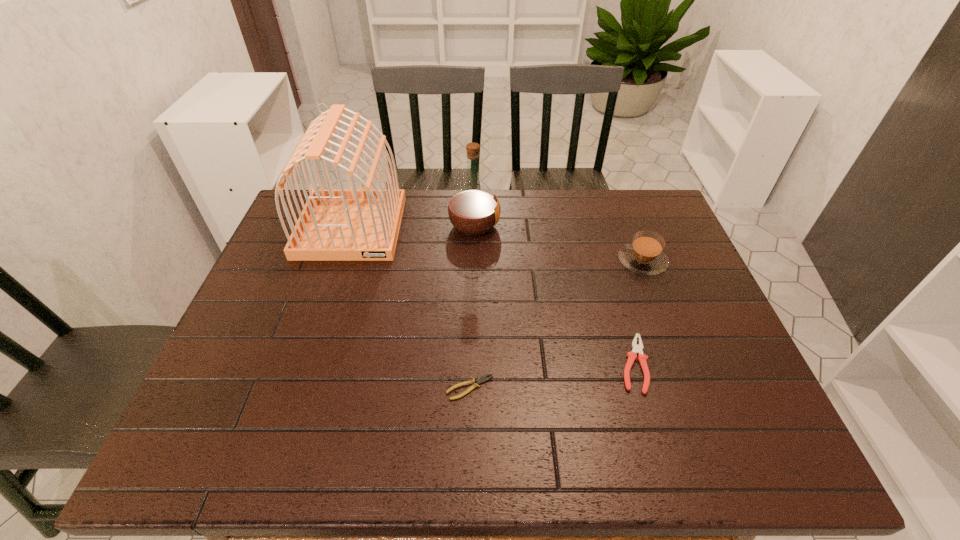
Locate an element on the screen. free location located on the front label of the fourth shortest object is located at coordinates (544, 226).

The image size is (960, 540). What are the coordinates of `blank space located on the back of the rightmost object` in the screenshot? It's located at (621, 206).

The height and width of the screenshot is (540, 960). I want to click on free space located on the back of the second shortest object, so click(607, 273).

What are the coordinates of `free space located on the left of the shorter pliers` in the screenshot? It's located at (375, 388).

The image size is (960, 540). What are the coordinates of `birdcage positioned at the far edge` in the screenshot? It's located at click(352, 224).

At what (x,y) coordinates should I click in order to perform the action: click on liquor located at the far edge. Please return your answer as a coordinate pair (x, y). Image resolution: width=960 pixels, height=540 pixels. Looking at the image, I should click on (473, 210).

The height and width of the screenshot is (540, 960). In order to click on object present at the left edge in this screenshot , I will do [x=352, y=224].

This screenshot has height=540, width=960. I want to click on object located in the right edge section of the desktop, so click(644, 255).

Find the location of a particular element. Image resolution: width=960 pixels, height=540 pixels. object that is at the far left corner is located at coordinates (352, 224).

Locate an element on the screen. vacant region at the far edge of the desktop is located at coordinates (503, 207).